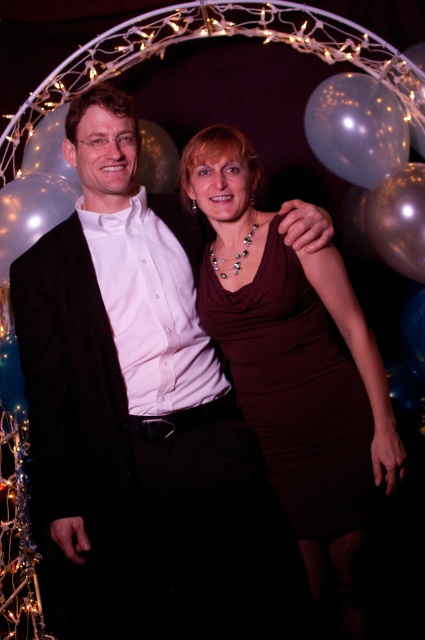
Question: Estimate the real-world distances between objects in this image. Which object is closer to the transparent plastic balloon at upper right?

Choices:
 (A) burgundy satin dress at center
 (B) transparent plastic balloon at left
 (C) metallic gold balloon at upper right

Answer: (C)

Question: Is transparent plastic balloon at upper right wider than metallic gold balloon at upper right?

Choices:
 (A) no
 (B) yes

Answer: (B)

Question: Which of the following is the farthest from the observer?

Choices:
 (A) transparent plastic balloon at left
 (B) burgundy satin dress at center

Answer: (A)

Question: Considering the relative positions of burgundy satin dress at center and transparent plastic balloon at left in the image provided, where is burgundy satin dress at center located with respect to transparent plastic balloon at left?

Choices:
 (A) below
 (B) above

Answer: (A)

Question: Which object appears farthest from the camera in this image?

Choices:
 (A) metallic gold balloon at upper right
 (B) transparent plastic balloon at left

Answer: (B)

Question: Is transparent plastic balloon at upper right to the left of metallic gold balloon at upper right from the viewer's perspective?

Choices:
 (A) no
 (B) yes

Answer: (B)